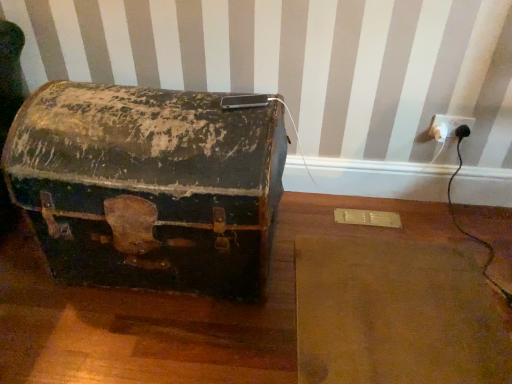
What is the approximate width of rusty metal trunk at center?

rusty metal trunk at center is 17.66 inches in width.

The width and height of the screenshot is (512, 384). I want to click on rusty metal trunk at center, so click(x=148, y=186).

This screenshot has height=384, width=512. What do you see at coordinates (148, 186) in the screenshot? I see `rusty metal trunk at center` at bounding box center [148, 186].

The height and width of the screenshot is (384, 512). What do you see at coordinates (448, 126) in the screenshot?
I see `white plastic outlet at right` at bounding box center [448, 126].

Image resolution: width=512 pixels, height=384 pixels. I want to click on white plastic outlet at right, so click(448, 126).

You are a GUI agent. You are given a task and a screenshot of the screen. Output one action in this format:
    pyautogui.click(x=<x>, y=<y>)
    Task: Click on the rusty metal trunk at center
    The width and height of the screenshot is (512, 384).
    Given the screenshot: What is the action you would take?
    pyautogui.click(x=148, y=186)

Would you say white plastic outlet at right is to the left or to the right of rusty metal trunk at center in the picture?

In the image, white plastic outlet at right appears on the right side of rusty metal trunk at center.

Which is behind, white plastic outlet at right or rusty metal trunk at center?

Positioned behind is white plastic outlet at right.

Is point (440, 114) more distant than point (44, 218)?

Yes.

From the image's perspective, is white plastic outlet at right on rusty metal trunk at center?

Correct, white plastic outlet at right appears higher than rusty metal trunk at center in the image.

From the picture: From a real-world perspective, is white plastic outlet at right located beneath rusty metal trunk at center?

No, from a real-world perspective, white plastic outlet at right is not beneath rusty metal trunk at center.

Between white plastic outlet at right and rusty metal trunk at center, which one has smaller width?

white plastic outlet at right.

Which of these two, white plastic outlet at right or rusty metal trunk at center, stands shorter?

Standing shorter between the two is white plastic outlet at right.

In the scene shown: Considering the sizes of objects white plastic outlet at right and rusty metal trunk at center in the image provided, who is bigger, white plastic outlet at right or rusty metal trunk at center?

rusty metal trunk at center.

Is rusty metal trunk at center located within white plastic outlet at right?

No, rusty metal trunk at center is not inside white plastic outlet at right.

Is there a large distance between white plastic outlet at right and rusty metal trunk at center?

That's right, there is a large distance between white plastic outlet at right and rusty metal trunk at center.

Is white plastic outlet at right facing away from rusty metal trunk at center?

white plastic outlet at right is not turned away from rusty metal trunk at center.

How far apart are white plastic outlet at right and rusty metal trunk at center?

white plastic outlet at right is 1.10 meters from rusty metal trunk at center.

The image size is (512, 384). I want to click on electric outlet that is behind the rusty metal trunk at center, so click(448, 126).

Which object is positioned more to the right, rusty metal trunk at center or white plastic outlet at right?

white plastic outlet at right.

Which object is closer to the camera taking this photo, rusty metal trunk at center or white plastic outlet at right?

rusty metal trunk at center is closer to the camera.

Which is in front, point (49, 202) or point (444, 133)?

The point (49, 202) is closer to the camera.

From the image's perspective, is rusty metal trunk at center located above or below white plastic outlet at right?

From the image's perspective, rusty metal trunk at center appears below white plastic outlet at right.

From a real-world perspective, who is located lower, rusty metal trunk at center or white plastic outlet at right?

In real-world perspective, rusty metal trunk at center is lower.

Considering the sizes of objects rusty metal trunk at center and white plastic outlet at right in the image provided, who is thinner, rusty metal trunk at center or white plastic outlet at right?

Thinner between the two is white plastic outlet at right.

From their relative heights in the image, would you say rusty metal trunk at center is taller or shorter than white plastic outlet at right?

Considering their sizes, rusty metal trunk at center has more height than white plastic outlet at right.

Is rusty metal trunk at center bigger than white plastic outlet at right?

Yes, rusty metal trunk at center is bigger than white plastic outlet at right.

Choose the correct answer: Is rusty metal trunk at center inside white plastic outlet at right or outside it?

The correct answer is: outside.

Is rusty metal trunk at center next to white plastic outlet at right and touching it?

rusty metal trunk at center and white plastic outlet at right are not in contact.

Is rusty metal trunk at center oriented towards white plastic outlet at right?

No, rusty metal trunk at center is not aimed at white plastic outlet at right.

How different are the orientations of rusty metal trunk at center and white plastic outlet at right in degrees?

There is a 1.05-degree angle between the facing directions of rusty metal trunk at center and white plastic outlet at right.

How much distance is there between rusty metal trunk at center and white plastic outlet at right?

A distance of 3.61 feet exists between rusty metal trunk at center and white plastic outlet at right.

This screenshot has height=384, width=512. Identify the location of box below the white plastic outlet at right (from a real-world perspective). pos(148,186).

Identify the location of electric outlet behind the rusty metal trunk at center. The image size is (512, 384). (448, 126).

There is a rusty metal trunk at center. Where is `electric outlet above it (from a real-world perspective)`? The image size is (512, 384). electric outlet above it (from a real-world perspective) is located at coordinates (448, 126).